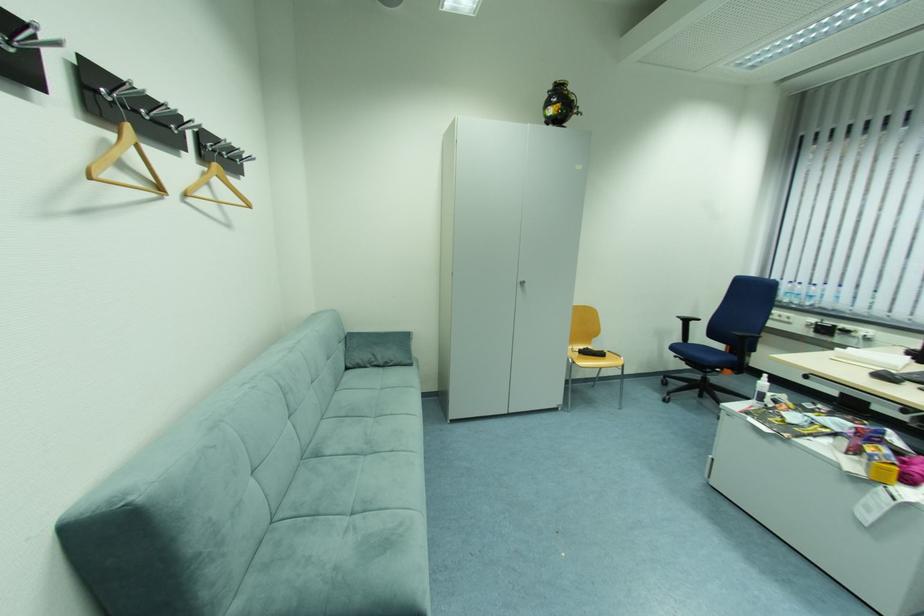
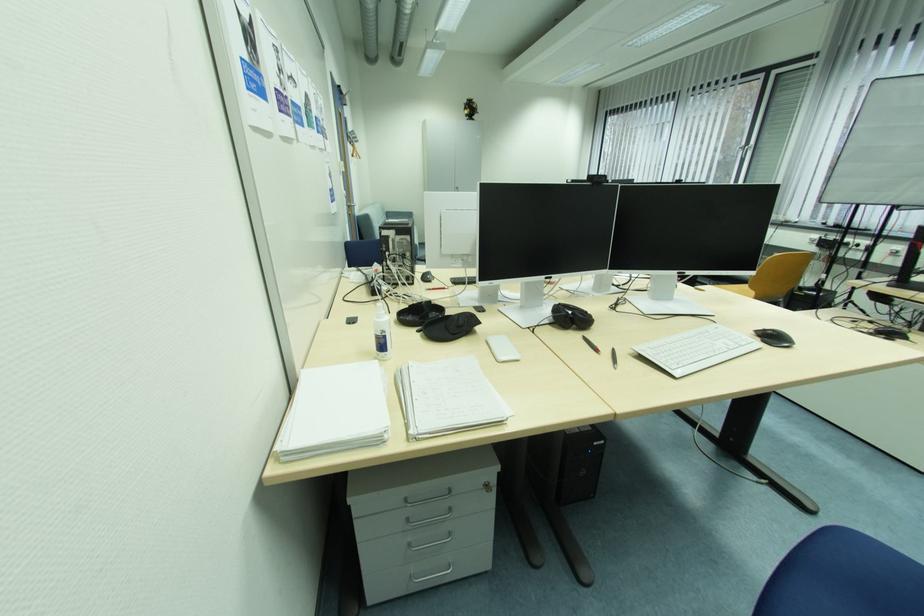
Question: The images are taken continuously from a first-person perspective. In which direction are you moving?

Choices:
 (A) Left
 (B) Right
 (C) Forward
 (D) Backward

Answer: (D)